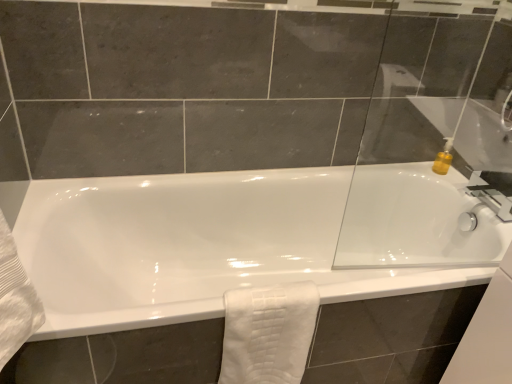
Question: In the image, is white textured towel at lower center positioned in front of or behind transparent glass door at upper right?

Choices:
 (A) behind
 (B) front

Answer: (A)

Question: Visually, is white textured towel at lower center positioned to the left or to the right of transparent glass door at upper right?

Choices:
 (A) right
 (B) left

Answer: (B)

Question: Estimate the real-world distances between objects in this image. Which object is farther from the white glossy bathtub at center?

Choices:
 (A) transparent glass door at upper right
 (B) white textured towel at lower center

Answer: (B)

Question: Based on their relative distances, which object is farther from the white glossy bathtub at center?

Choices:
 (A) white textured towel at lower center
 (B) transparent glass door at upper right

Answer: (A)